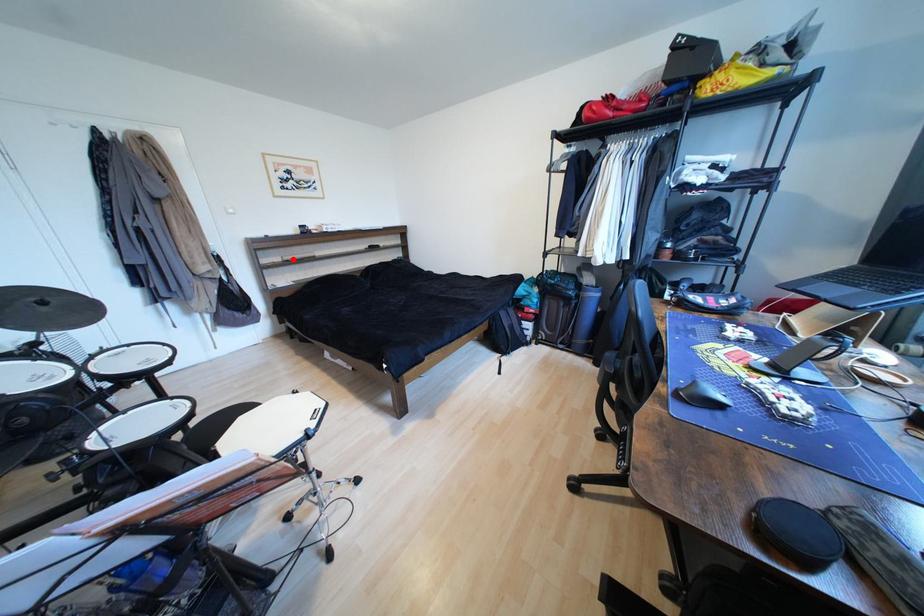
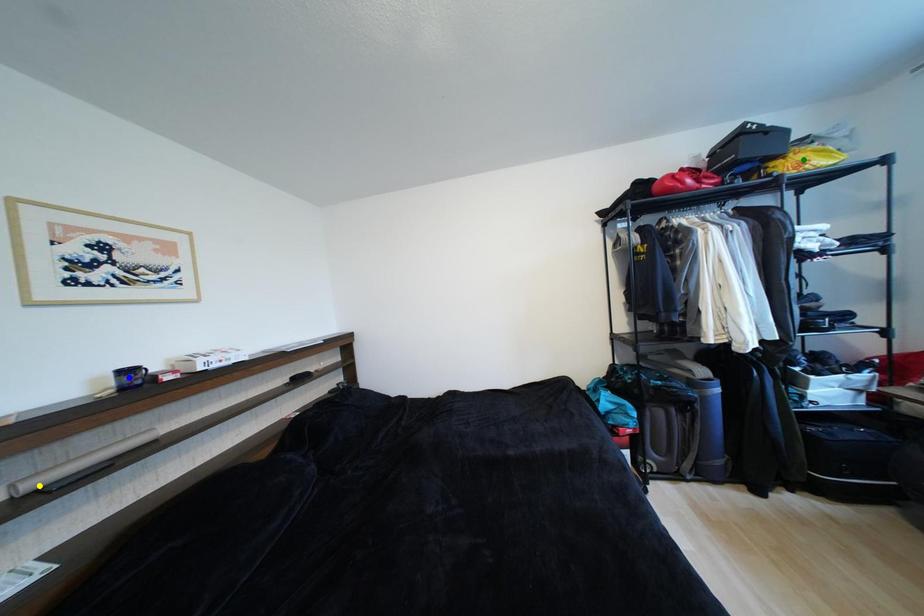
Question: I am providing you with two images of the same scene from different viewpoints. A red point is marked on the first image. You are given multiple points on the second image. Which point in image 2 is actually the same real-world point as the red point in image 1?

Choices:
 (A) green point
 (B) yellow point
 (C) blue point

Answer: (B)